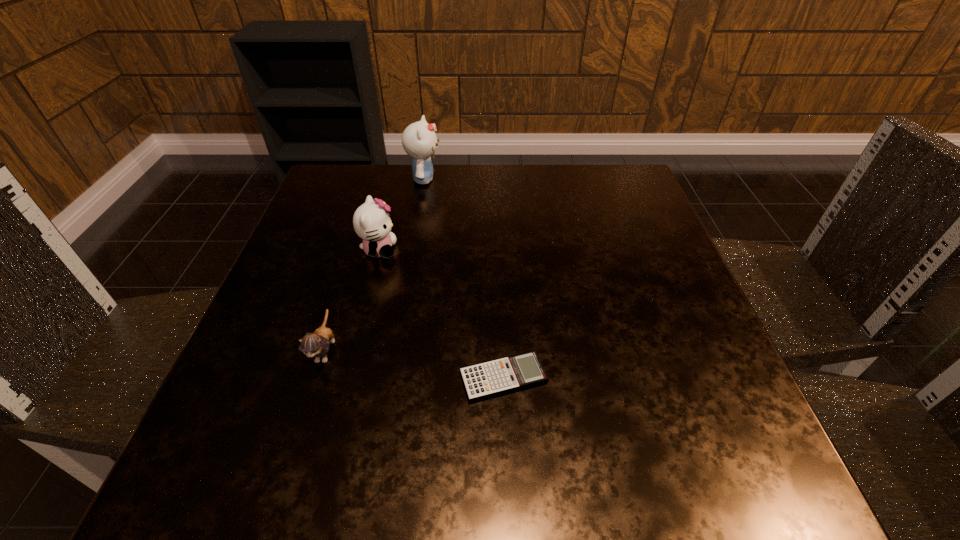
Find the location of a particular element. The width and height of the screenshot is (960, 540). free space located 0.080m on the front-facing side of the nearest kitten is located at coordinates (302, 424).

Locate an element on the screen. This screenshot has width=960, height=540. blank space located on the left of the rightmost object is located at coordinates (276, 378).

The width and height of the screenshot is (960, 540). In order to click on object positioned at the far edge in this screenshot , I will do `click(419, 140)`.

The image size is (960, 540). I want to click on vacant space at the far edge, so click(x=467, y=181).

At what (x,y) coordinates should I click in order to perform the action: click on free space at the near edge of the desktop. Please return your answer as a coordinate pair (x, y). Looking at the image, I should click on (483, 483).

Where is `free location at the left edge of the desktop`? The height and width of the screenshot is (540, 960). free location at the left edge of the desktop is located at coordinates (x=343, y=252).

Locate an element on the screen. The width and height of the screenshot is (960, 540). vacant space at the right edge of the desktop is located at coordinates (600, 225).

The image size is (960, 540). In order to click on vacant region at the far left corner of the desktop in this screenshot , I will do `click(310, 218)`.

In the image, there is a desktop. At what (x,y) coordinates should I click in order to perform the action: click on free space at the near left corner. Please return your answer as a coordinate pair (x, y). The height and width of the screenshot is (540, 960). Looking at the image, I should click on tap(188, 471).

Locate an element on the screen. The image size is (960, 540). vacant space that's between the second tallest object and the tallest object is located at coordinates (401, 215).